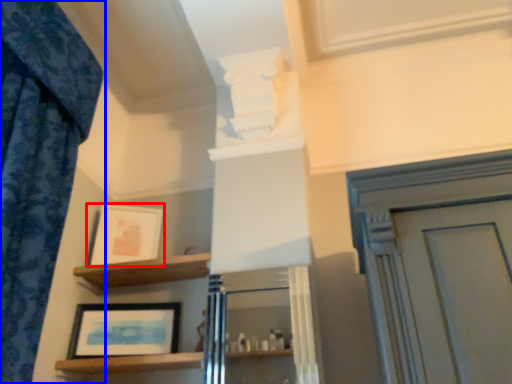
Question: Which point is further to the camera, picture frame (highlighted by a red box) or curtain (highlighted by a blue box)?

Choices:
 (A) picture frame
 (B) curtain

Answer: (A)